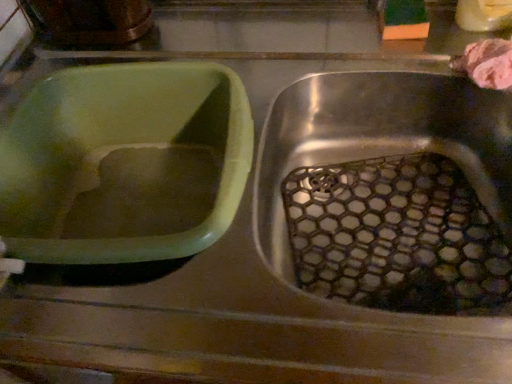
Question: Can you confirm if green plastic basin at left is positioned to the left of pink fluffy sponge at upper right?

Choices:
 (A) no
 (B) yes

Answer: (B)

Question: Would you say green plastic basin at left is outside pink fluffy sponge at upper right?

Choices:
 (A) yes
 (B) no

Answer: (A)

Question: From the image's perspective, is green plastic basin at left located above pink fluffy sponge at upper right?

Choices:
 (A) yes
 (B) no

Answer: (B)

Question: Does green plastic basin at left lie behind pink fluffy sponge at upper right?

Choices:
 (A) no
 (B) yes

Answer: (A)

Question: Considering the relative sizes of green plastic basin at left and pink fluffy sponge at upper right in the image provided, is green plastic basin at left shorter than pink fluffy sponge at upper right?

Choices:
 (A) no
 (B) yes

Answer: (A)

Question: From a real-world perspective, is green plastic basin at left located beneath pink fluffy sponge at upper right?

Choices:
 (A) yes
 (B) no

Answer: (A)

Question: From the image's perspective, is pink fluffy sponge at upper right located above green plastic basin at left?

Choices:
 (A) no
 (B) yes

Answer: (B)

Question: Can you confirm if pink fluffy sponge at upper right is smaller than green plastic basin at left?

Choices:
 (A) yes
 (B) no

Answer: (A)

Question: Is pink fluffy sponge at upper right aimed at green plastic basin at left?

Choices:
 (A) yes
 (B) no

Answer: (B)

Question: Is pink fluffy sponge at upper right facing away from green plastic basin at left?

Choices:
 (A) no
 (B) yes

Answer: (A)

Question: Is pink fluffy sponge at upper right next to green plastic basin at left?

Choices:
 (A) yes
 (B) no

Answer: (B)

Question: Is green plastic basin at left a part of pink fluffy sponge at upper right?

Choices:
 (A) no
 (B) yes

Answer: (A)

Question: Considering the positions of point (172, 130) and point (474, 59), is point (172, 130) closer or farther from the camera than point (474, 59)?

Choices:
 (A) closer
 (B) farther

Answer: (B)